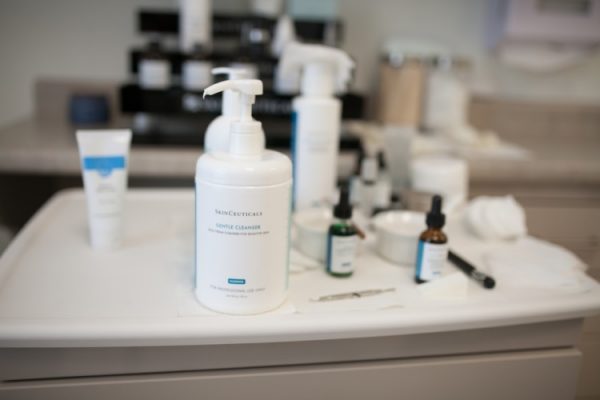
Find the location of a particular element. The image size is (600, 400). gray counter is located at coordinates (63, 142).